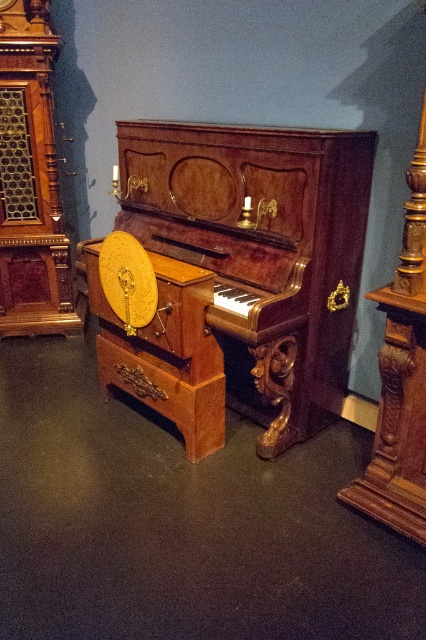
Which is above, mahogany polished piano at center or polished wood clock at left?

Positioned higher is polished wood clock at left.

Is mahogany polished piano at center wider than polished wood clock at left?

Yes.

This screenshot has height=640, width=426. What do you see at coordinates (241, 272) in the screenshot?
I see `mahogany polished piano at center` at bounding box center [241, 272].

In order to click on mahogany polished piano at center in this screenshot , I will do `click(241, 272)`.